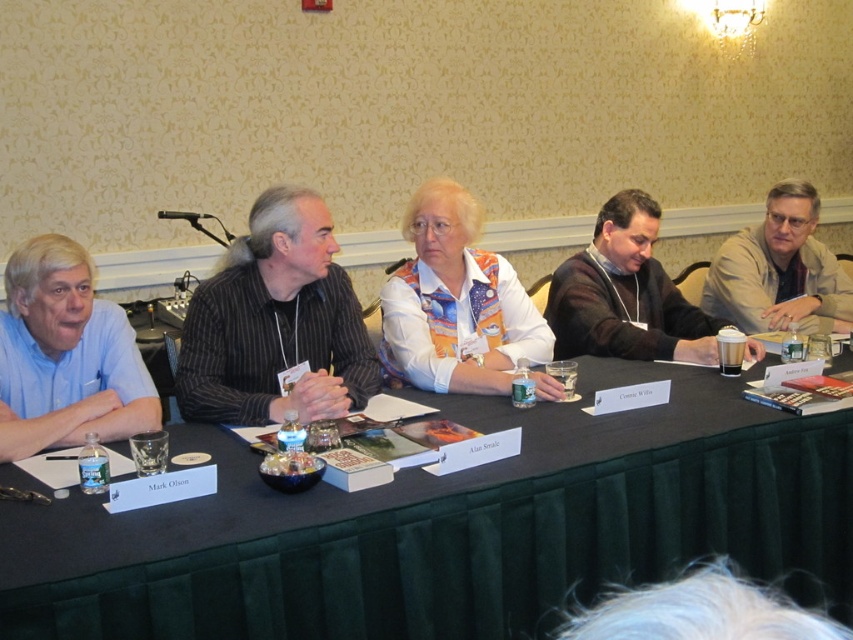
You are sitting in the audience and want to see both the green fabric table at center and the blue shirt at left clearly. Which one appears larger in your view?

The green fabric table at center appears larger because it is closer to you than the blue shirt at left.

You are organizing a conference and need to place a large decorative centerpiece on the green fabric table at center. However, there is a tan fabric jacket at right on the table. Can the centerpiece be placed in the middle of the table without overlapping the jacket?

The green fabric table at center might be wider than tan fabric jacket at right, so it is possible that the centerpiece can be placed in the middle without overlapping the jacket if the table has sufficient width. However, the exact placement depends on the actual dimensions and positioning of both items.